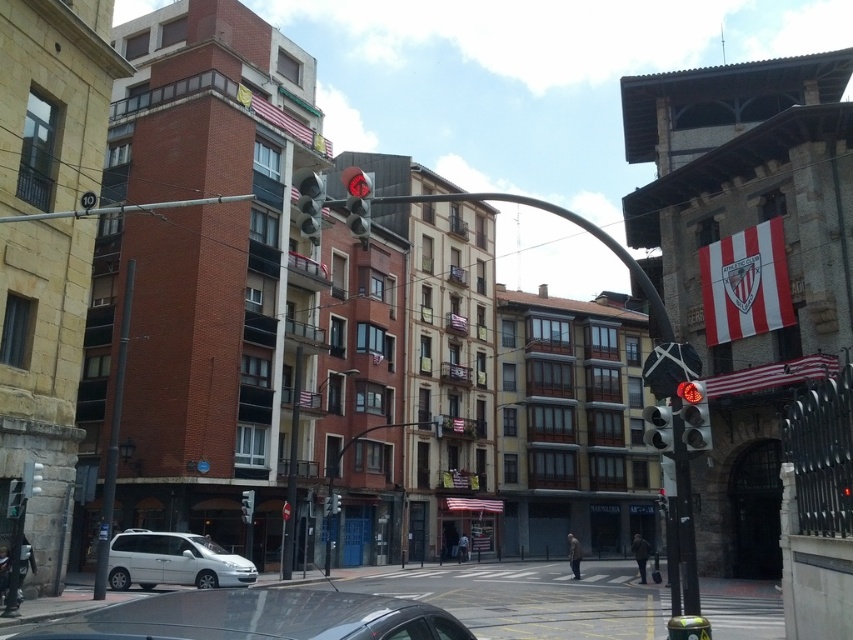
Question: Which point is farther to the camera?

Choices:
 (A) (656, 440)
 (B) (132, 624)
 (C) (312, 196)

Answer: (C)

Question: Estimate the real-world distances between objects in this image. Which object is farther from the matte glass traffic light at center?

Choices:
 (A) metallic red traffic light at right
 (B) metallic traffic light at center
 (C) white matte van at lower left

Answer: (B)

Question: Is metallic red traffic light at right to the left of metallic traffic light at center from the viewer's perspective?

Choices:
 (A) no
 (B) yes

Answer: (B)

Question: Can you confirm if metallic red traffic light at right is positioned to the right of matte glass traffic light at center?

Choices:
 (A) no
 (B) yes

Answer: (B)

Question: Does white matte van at lower left have a lesser width compared to matte glass traffic light at center?

Choices:
 (A) no
 (B) yes

Answer: (A)

Question: Which object is closer to the camera taking this photo?

Choices:
 (A) metallic traffic light at center
 (B) smooth metal pole at left

Answer: (A)